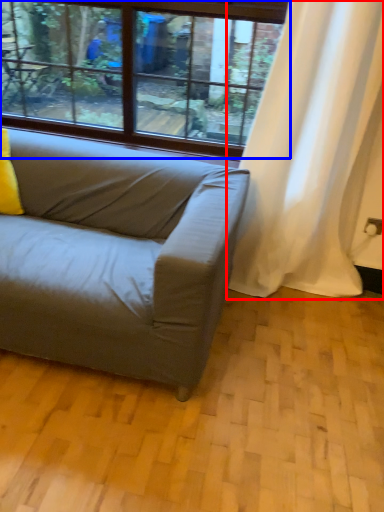
Question: Which object appears closest to the camera in this image, curtain (highlighted by a red box) or window (highlighted by a blue box)?

Choices:
 (A) curtain
 (B) window

Answer: (A)